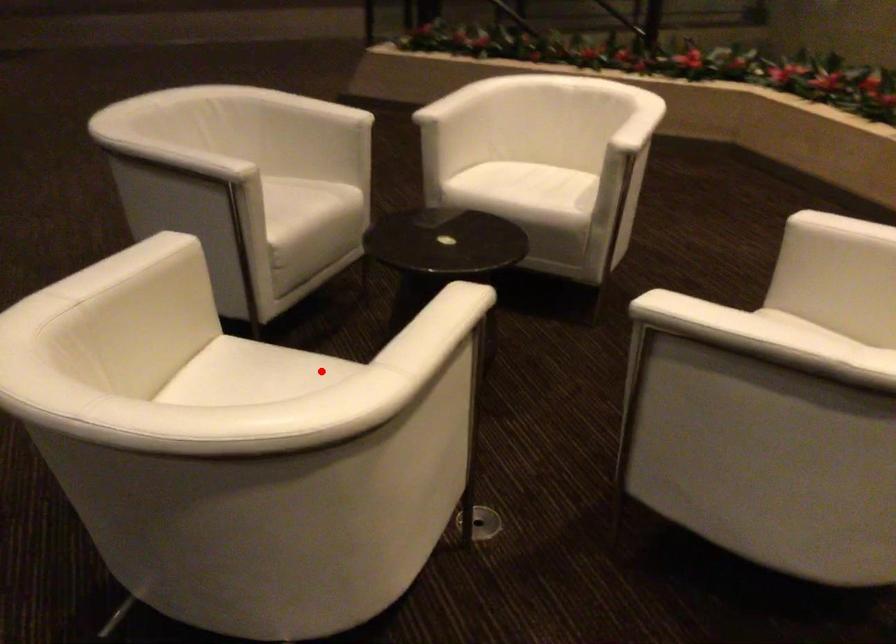
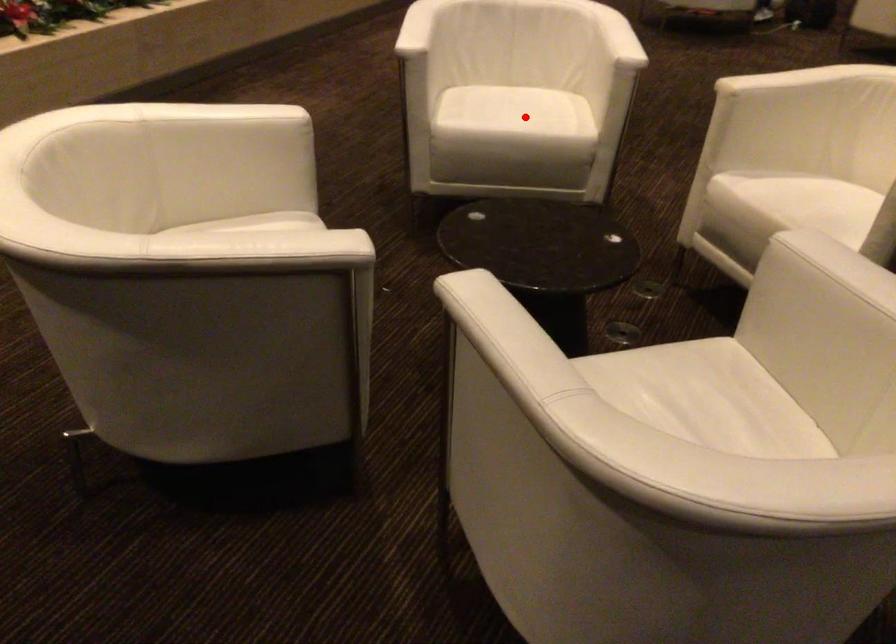
I am providing you with two images of the same scene from different viewpoints. A red point is marked on the first image and another point is marked on the second image. Is the marked point in image1 the same physical position as the marked point in image2?

No